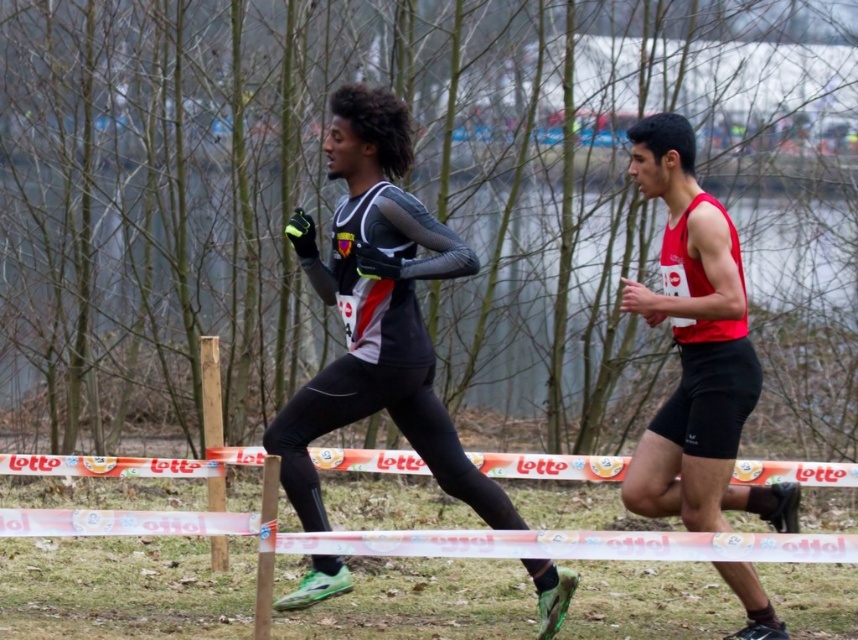
You are a photographer standing at the center of the image. You want to take a photo of the two points mentioned. Which point, point (x=336, y=298) or point (x=732, y=294), will appear closer to you in the photo?

Point (x=336, y=298) will appear closer to you in the photo because it is further to the viewer than point (x=732, y=294).

You are a race official checking the course markers. You see the white plastic tape at center and the matte red jersey at right. Which object is located lower in the image?

The white plastic tape at center is positioned under the matte red jersey at right, so it is located lower in the image.

Consider the image. You are a race official checking the starting line. You see the white plastic tape at center and the matte black running suit at center. Which object is narrower?

The white plastic tape at center is narrower than the matte black running suit at center.